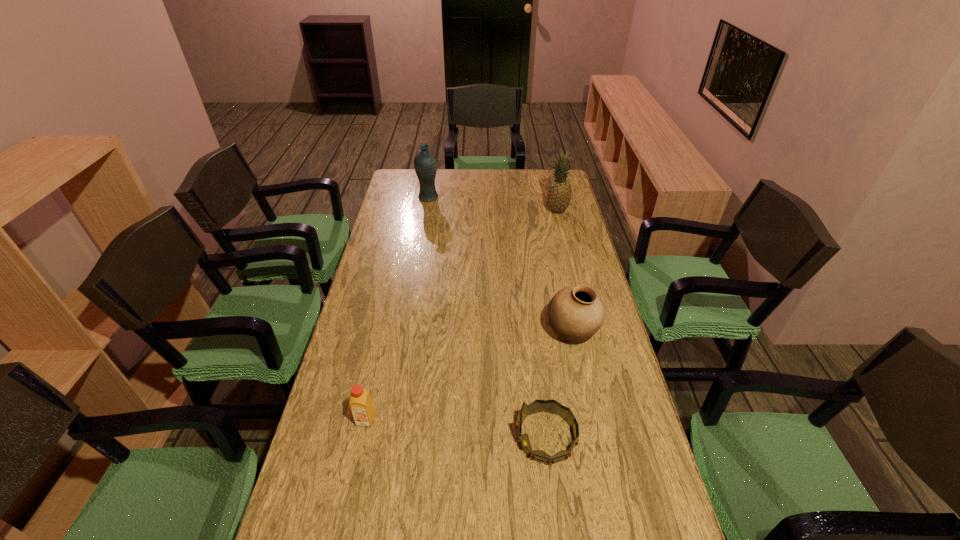
Where is `blank space located 0.320m at the front of the shortest object with jewels`? This screenshot has width=960, height=540. blank space located 0.320m at the front of the shortest object with jewels is located at coordinates (392, 436).

Locate an element on the screen. Image resolution: width=960 pixels, height=540 pixels. vacant point located 0.270m at the front of the shortest object with jewels is located at coordinates (411, 436).

This screenshot has width=960, height=540. What are the coordinates of `free location located at the front of the shortest object with jewels` in the screenshot? It's located at (x=369, y=436).

Where is `object positioned at the far edge`? The image size is (960, 540). object positioned at the far edge is located at coordinates (425, 162).

This screenshot has height=540, width=960. In order to click on vase that is at the left edge in this screenshot , I will do `click(425, 162)`.

Identify the location of orange juice present at the left edge. (360, 403).

At what (x,y) coordinates should I click in order to perform the action: click on pineapple that is at the right edge. Please return your answer as a coordinate pair (x, y). Looking at the image, I should click on (559, 194).

In order to click on pottery located in the right edge section of the desktop in this screenshot , I will do `click(575, 313)`.

Identify the location of object present at the far left corner. The height and width of the screenshot is (540, 960). (425, 162).

What are the coordinates of `blank space at the far edge` in the screenshot? It's located at (513, 182).